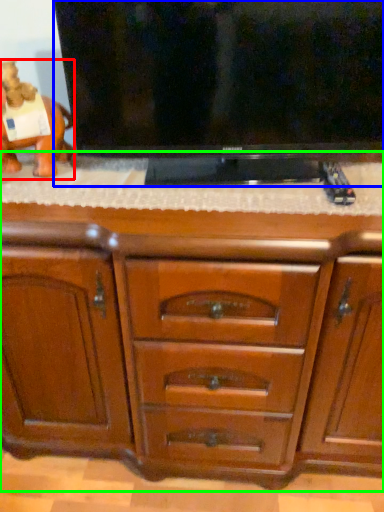
Question: Which object is positioned closest to animal (highlighted by a red box)? Select from television (highlighted by a blue box) and chest of drawers (highlighted by a green box).

Choices:
 (A) television
 (B) chest of drawers

Answer: (A)